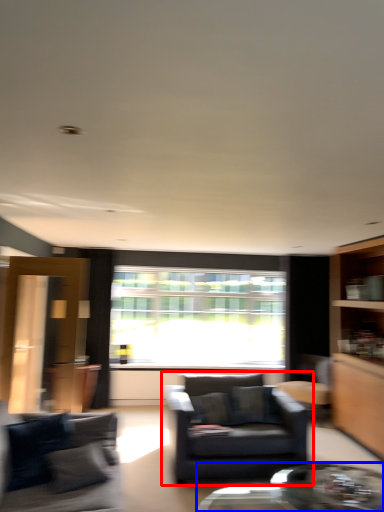
Question: Which point is further to the camera, chair (highlighted by a red box) or coffee table (highlighted by a blue box)?

Choices:
 (A) chair
 (B) coffee table

Answer: (A)